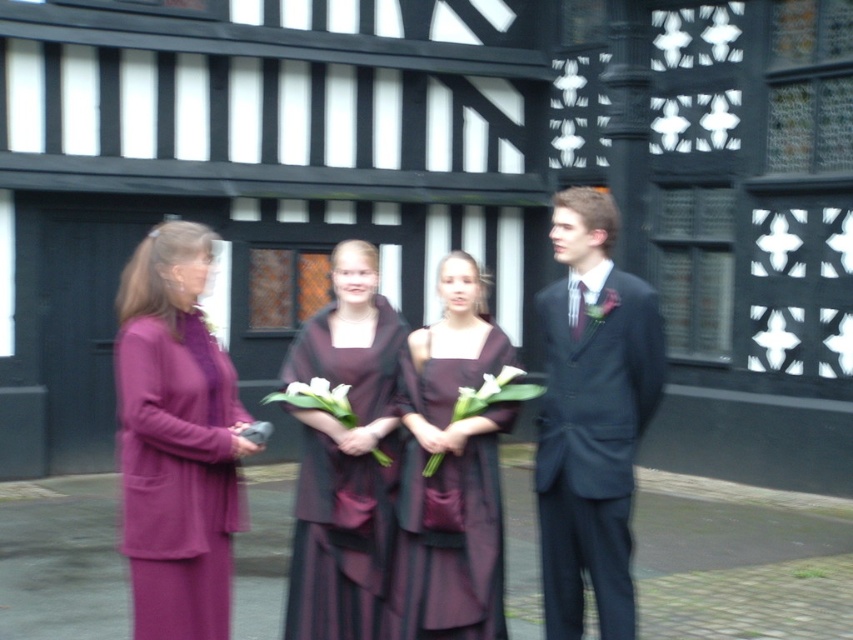
Question: Which of the following is the closest to the observer?

Choices:
 (A) (485, 392)
 (B) (521, 372)
 (C) (554, 477)
 (D) (486, 394)

Answer: (C)

Question: Which is farther from the burgundy satin dress at center?

Choices:
 (A) matte burgundy dress at center
 (B) white matte calla lily at center
 (C) matte black suit at center
 (D) purple matte dress at left

Answer: (C)

Question: Is matte burgundy dress at center behind burgundy satin dress at center?

Choices:
 (A) no
 (B) yes

Answer: (A)

Question: Is purple matte dress at left further to camera compared to burgundy satin dress at center?

Choices:
 (A) no
 (B) yes

Answer: (A)

Question: Is white silk flower at center wider than white matte calla lily at center?

Choices:
 (A) yes
 (B) no

Answer: (B)

Question: Which object is closer to the camera taking this photo?

Choices:
 (A) burgundy satin dress at center
 (B) purple matte dress at left
 (C) matte burgundy dress at center
 (D) white matte flowers at center

Answer: (B)